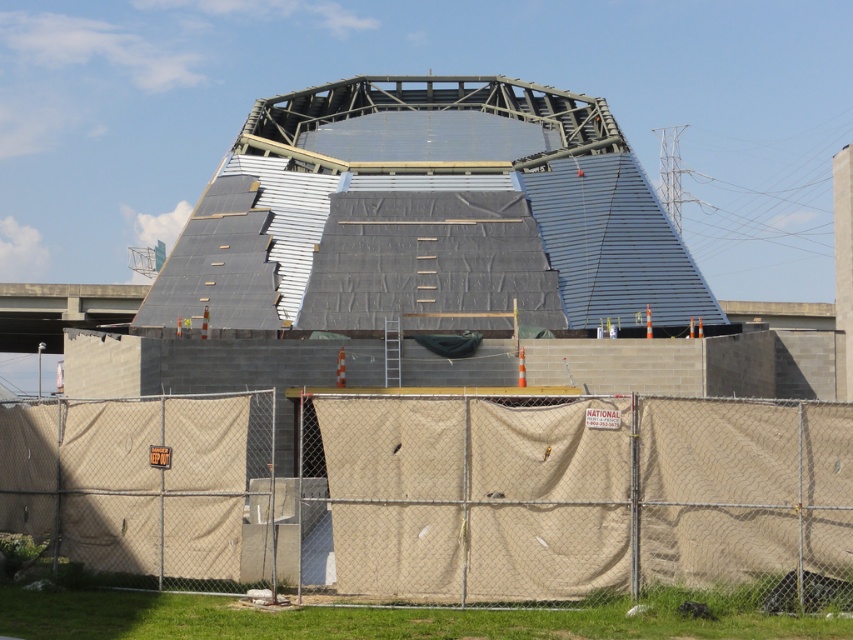
Question: Which point is farther from the camera taking this photo?

Choices:
 (A) (9, 332)
 (B) (606, 547)

Answer: (A)

Question: Is beige fabric fence at lower center below concrete bridge at left?

Choices:
 (A) no
 (B) yes

Answer: (B)

Question: Can you confirm if beige fabric fence at lower center is positioned to the left of concrete bridge at left?

Choices:
 (A) no
 (B) yes

Answer: (A)

Question: Is beige fabric fence at lower center closer to the viewer compared to concrete bridge at left?

Choices:
 (A) no
 (B) yes

Answer: (B)